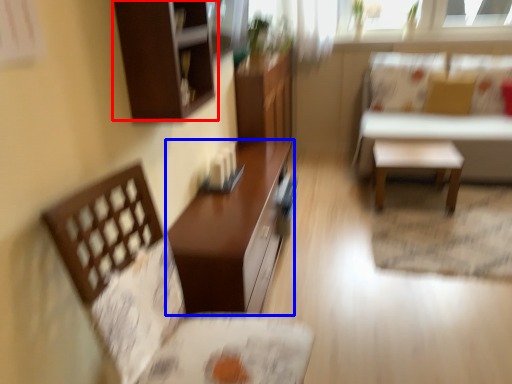
Question: Which point is further to the camera, cabinetry (highlighted by a red box) or table (highlighted by a blue box)?

Choices:
 (A) cabinetry
 (B) table

Answer: (B)